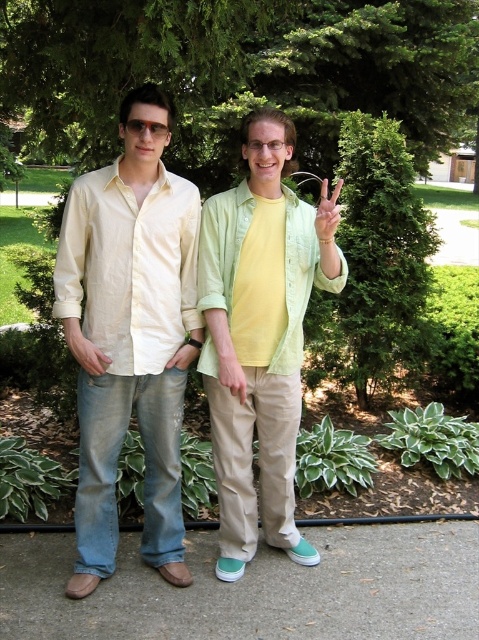
Question: Which of the following is the closest to the observer?

Choices:
 (A) (146, 168)
 (B) (281, 404)

Answer: (A)

Question: Can you confirm if green leafy tree at upper center is positioned to the right of matte yellow shirt at center?

Choices:
 (A) no
 (B) yes

Answer: (B)

Question: Is green leafy tree at upper center further to the viewer compared to gray concrete pavement at lower center?

Choices:
 (A) yes
 (B) no

Answer: (B)

Question: Among these points, which one is nearest to the camera?

Choices:
 (A) (78, 346)
 (B) (106, 44)

Answer: (A)

Question: Which object appears closest to the camera in this image?

Choices:
 (A) green leafy tree at upper center
 (B) light green fabric shirt at center
 (C) matte black glasses at center
 (D) green matte hand at center

Answer: (A)

Question: Observing the image, what is the correct spatial positioning of matte yellow shirt at center in reference to matte black glasses at center?

Choices:
 (A) right
 (B) left

Answer: (B)